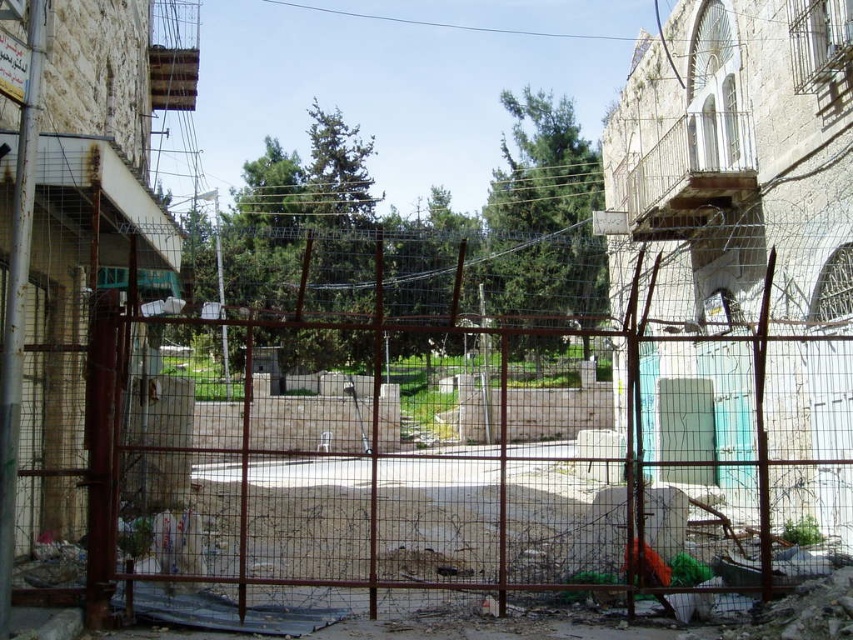
Based on the photo, you are a delivery person trying to enter the compound through the transparent plastic door at center. The rusty metal fence at center is blocking your path. Can you walk through the gap between them?

The rusty metal fence at center is much taller than the transparent plastic door at center, so the gap between them is too narrow for you to walk through.

You are standing in front of the image and want to describe the position of the rusty metal fence at center. What are its coordinates?

The rusty metal fence at center is located at coordinates (437, 460).